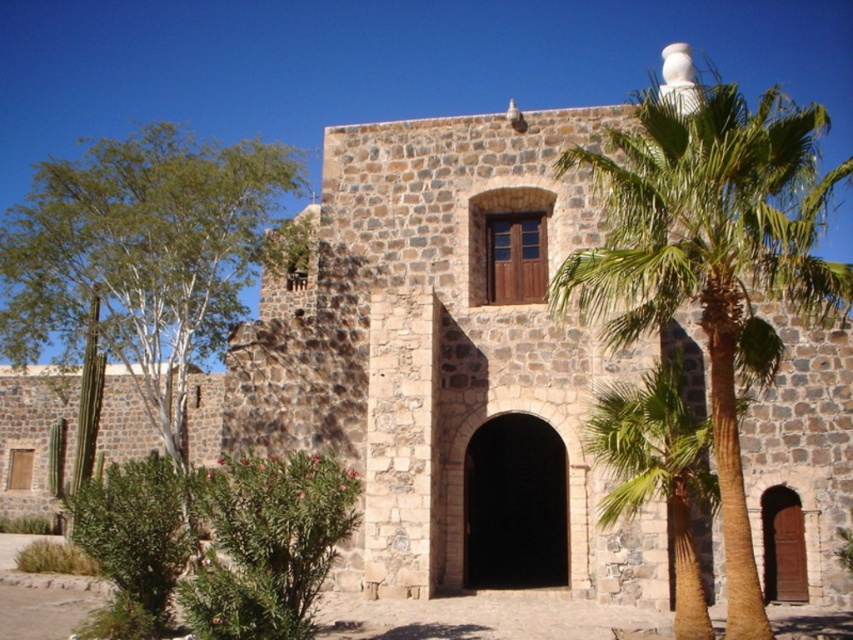
Question: Which point is closer to the camera?

Choices:
 (A) (711, 90)
 (B) (631, 429)
 (C) (19, 337)

Answer: (A)

Question: Which of the following is the farthest from the observer?

Choices:
 (A) (x=173, y=204)
 (B) (x=601, y=419)

Answer: (A)

Question: Where is green leafy palm tree at upper right located in relation to green leafy palm tree at center in the image?

Choices:
 (A) right
 (B) left

Answer: (A)

Question: Which object is farther from the camera taking this photo?

Choices:
 (A) green leafy palm tree at upper right
 (B) green leafy palm tree at center

Answer: (B)

Question: Does green leafy palm tree at upper right come behind green leafy tree at left?

Choices:
 (A) yes
 (B) no

Answer: (B)

Question: From the image, what is the correct spatial relationship of green leafy tree at left in relation to green leafy palm tree at center?

Choices:
 (A) right
 (B) left

Answer: (B)